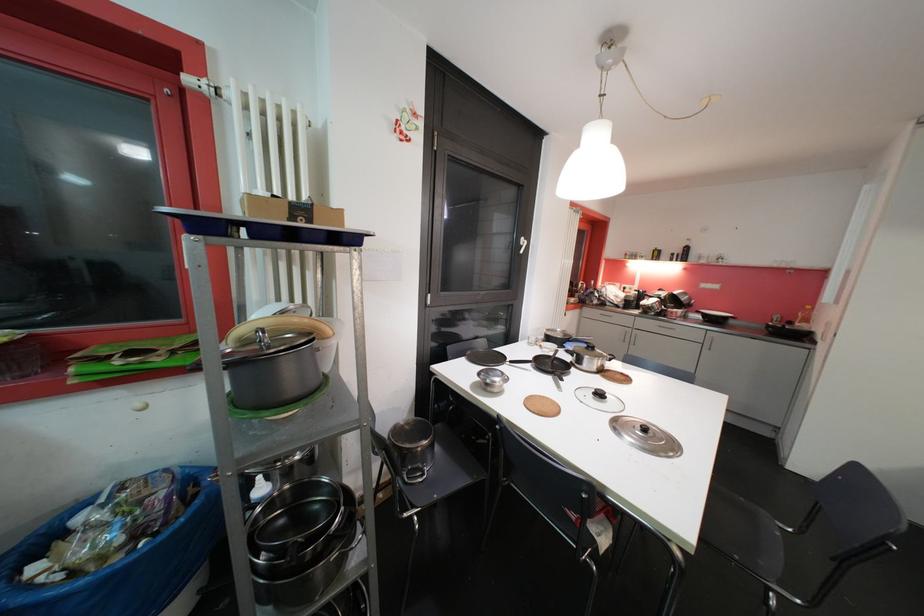
The height and width of the screenshot is (616, 924). What do you see at coordinates (523, 245) in the screenshot?
I see `the white window handle` at bounding box center [523, 245].